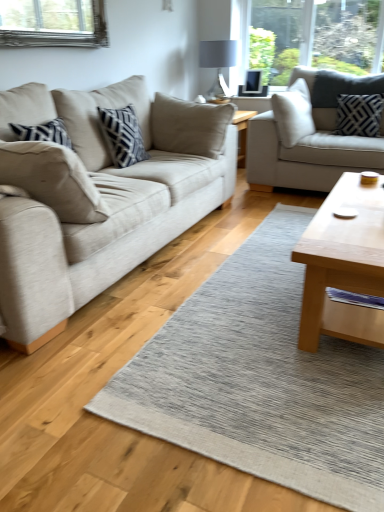
Locate an element on the screen. vacant region to the left of light brown wooden coffee table at center right is located at coordinates (214, 304).